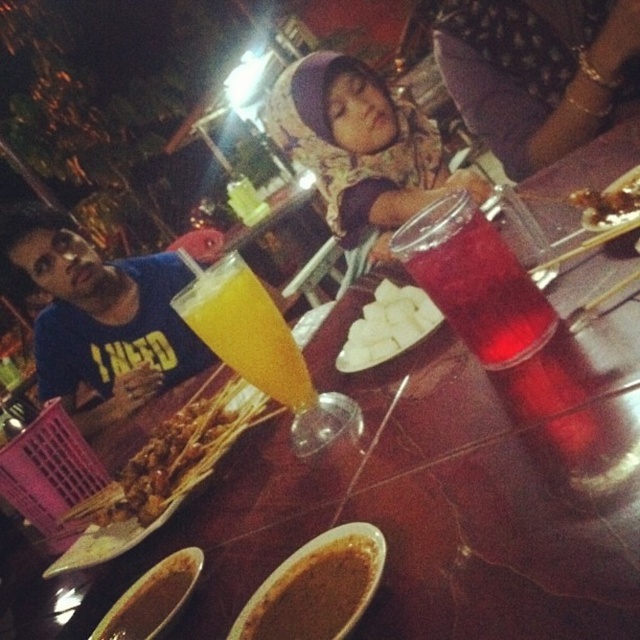
You are a customer at this outdoor dining area and want to place your phone on the table. The phone is 15 cm in length. Can you place it between the purple fabric headscarf at upper center and the savory skewers at center?

The purple fabric headscarf at upper center has a greater height compared to savory skewers at center. This means there might be enough space between them to place your phone, but since the headscarf is taller, it could cast a shadow or lean over. However, the exact distance isn not provided, so it depends on how they are positioned.

You are at a street food stall and want to choose a drink. You see the translucent glass beverage at center right and the brown matte bowl at lower center. Which one holds more liquid?

The translucent glass beverage at center right has a larger size compared to the brown matte bowl at lower center, so it holds more liquid.